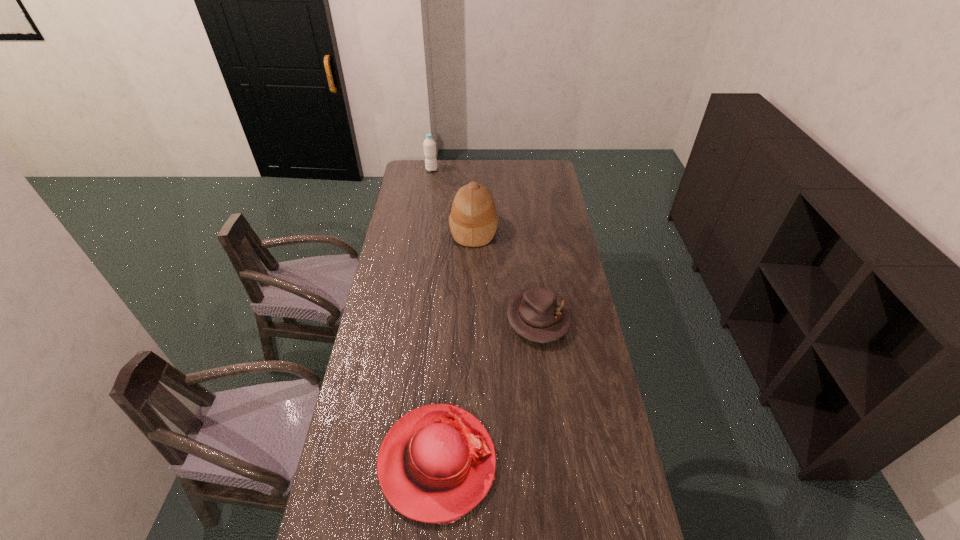
At what (x,y) coordinates should I click in order to perform the action: click on the tallest hat. Please return your answer as a coordinate pair (x, y). This screenshot has width=960, height=540. Looking at the image, I should click on (473, 221).

The height and width of the screenshot is (540, 960). Identify the location of the farthest hat. [473, 221].

Identify the location of water bottle. The image size is (960, 540). (429, 144).

Where is `the nearest hat`? The width and height of the screenshot is (960, 540). the nearest hat is located at coordinates (437, 462).

Identify the location of the nearest object. Image resolution: width=960 pixels, height=540 pixels. (437, 462).

Where is `the rightmost hat`? the rightmost hat is located at coordinates (537, 314).

You are a GUI agent. You are given a task and a screenshot of the screen. Output one action in this format:
    pyautogui.click(x=<x>, y=<y>)
    Task: Click on the rightmost object
    
    Given the screenshot: What is the action you would take?
    pyautogui.click(x=537, y=314)

In order to click on free space located on the front-facing side of the second farthest object in this screenshot , I will do `click(528, 228)`.

Where is `vacant space located 0.140m on the right of the water bottle`? The width and height of the screenshot is (960, 540). vacant space located 0.140m on the right of the water bottle is located at coordinates pyautogui.click(x=463, y=170).

Image resolution: width=960 pixels, height=540 pixels. In order to click on vacant space located 0.160m at the front of the second tallest hat with a bow in this screenshot , I will do `click(551, 462)`.